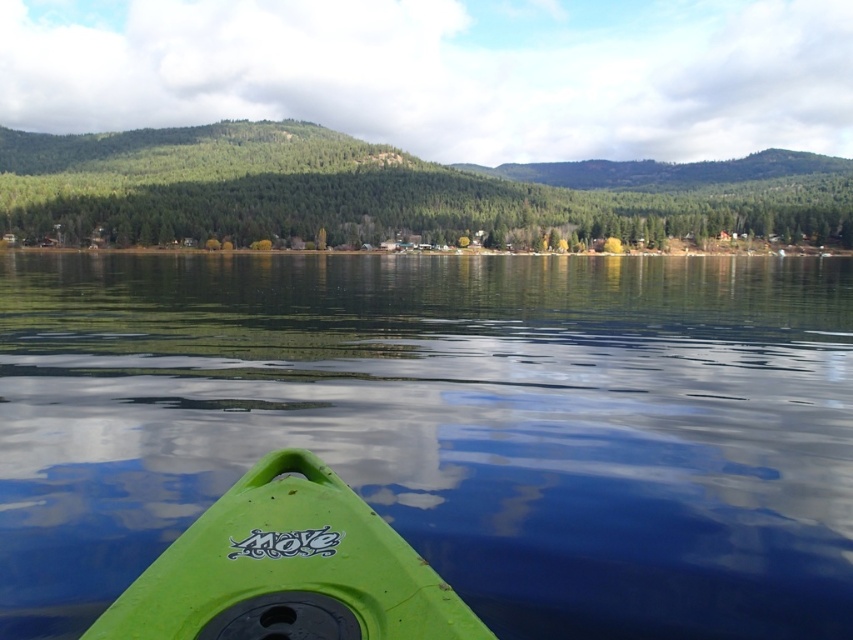
You are in a kayak and want to check if the transparent water at center is above the green matte kayak at lower center. Based on the scene description, can you confirm this?

Yes, the transparent water at center is positioned over the green matte kayak at lower center, so it is indeed above the kayak.